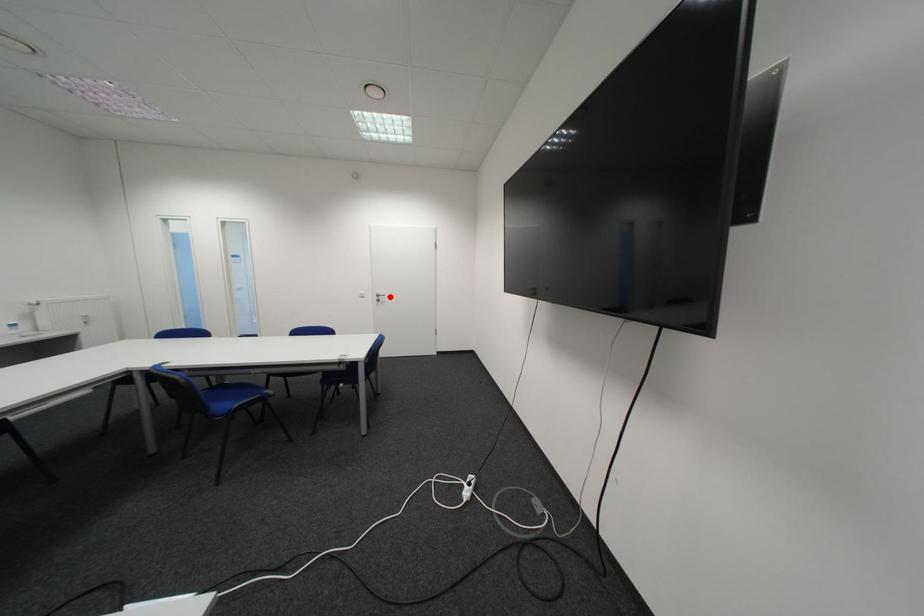
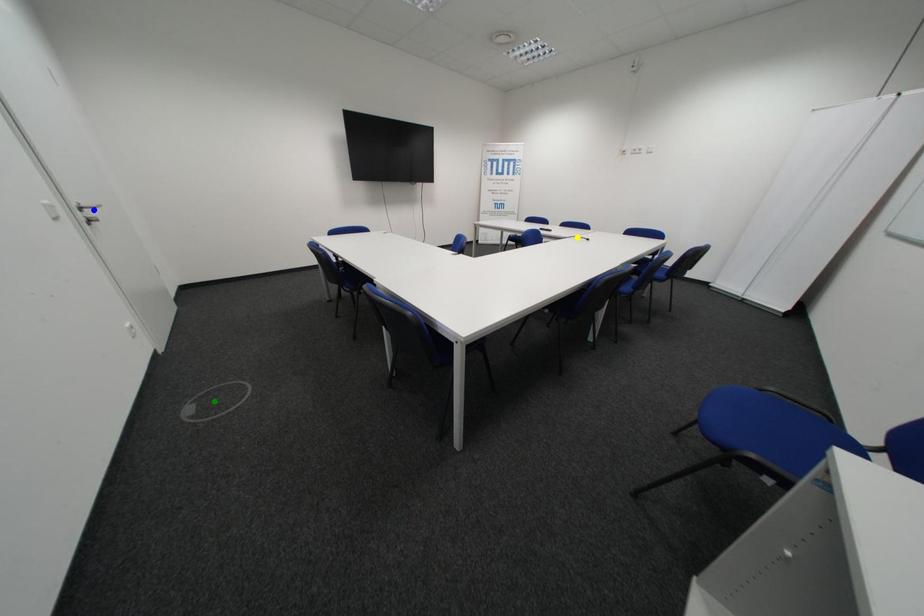
Question: I am providing you with two images of the same scene from different viewpoints. A red point is marked on the first image. You are given multiple points on the second image. Which mark in image 2 goes with the point in image 1?

Choices:
 (A) yellow point
 (B) green point
 (C) blue point

Answer: (C)